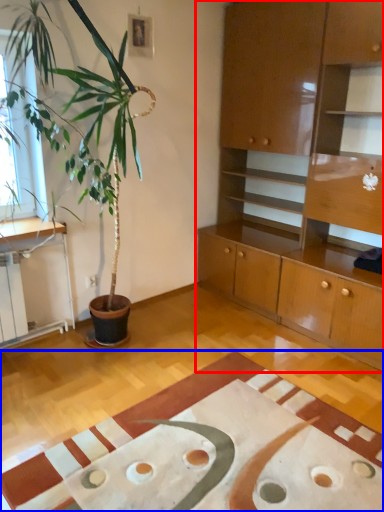
Question: Which point is closer to the camera, cabinetry (highlighted by a red box) or plain (highlighted by a blue box)?

Choices:
 (A) cabinetry
 (B) plain

Answer: (B)